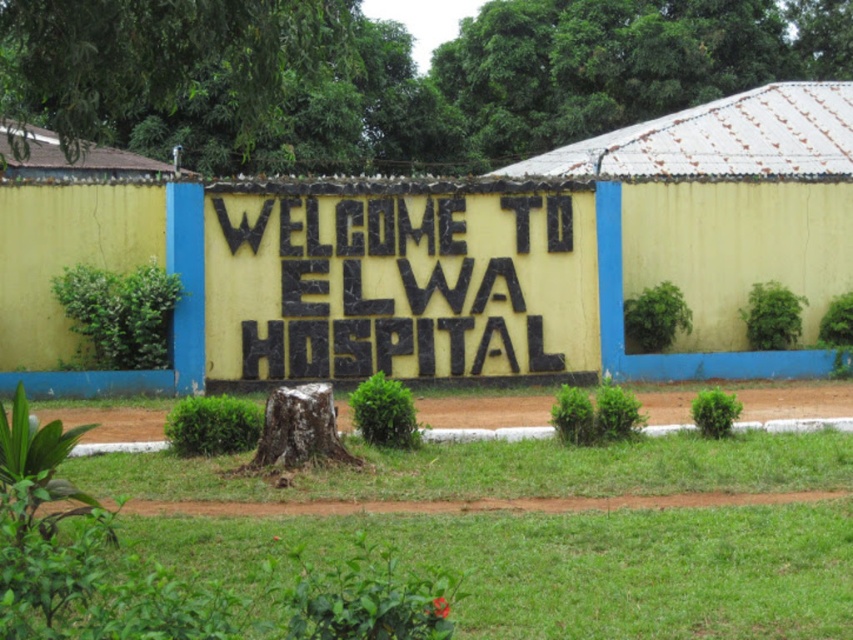
Who is positioned more to the left, blackmaterial/texture sign at center or brown rough tree stump at center?

brown rough tree stump at center is more to the left.

Who is taller, blackmaterial/texture sign at center or brown rough tree stump at center?

blackmaterial/texture sign at center is taller.

Identify the location of blackmaterial/texture sign at center. (392, 285).